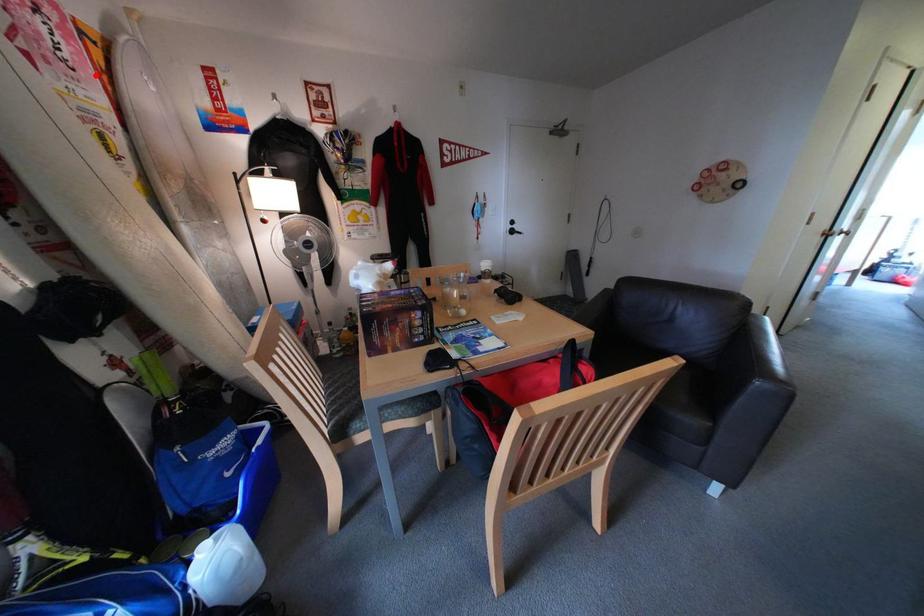
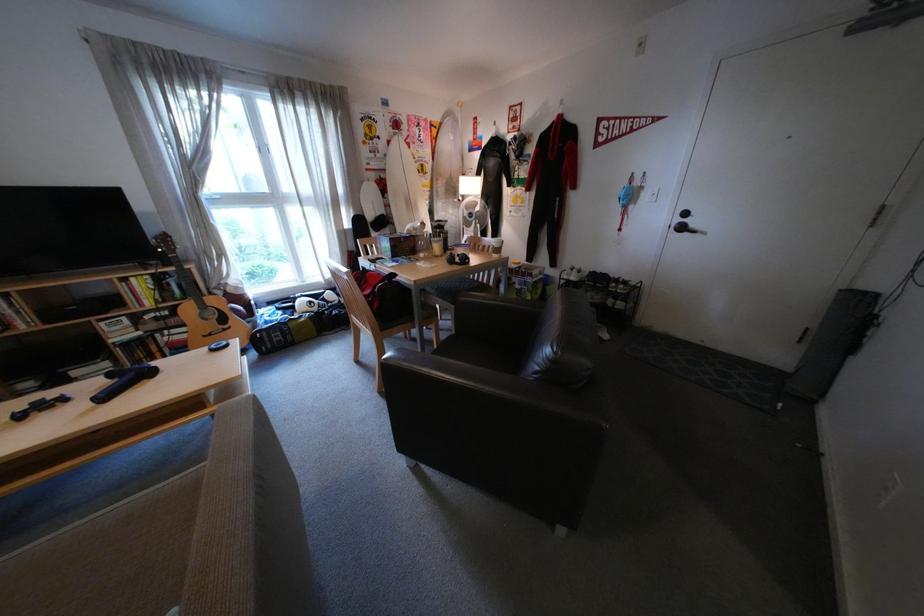
In the second image, find the point that corresponds to the highlighted location in the first image.

(439, 145)